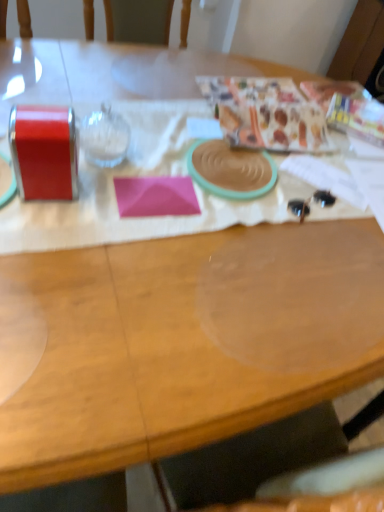
I want to click on free space in front of pink matte paper at center, so click(122, 237).